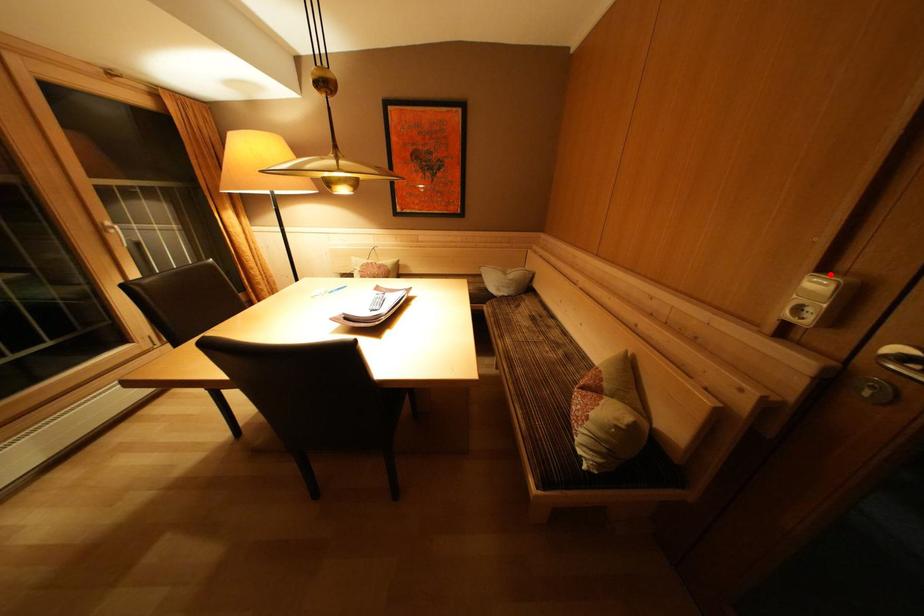
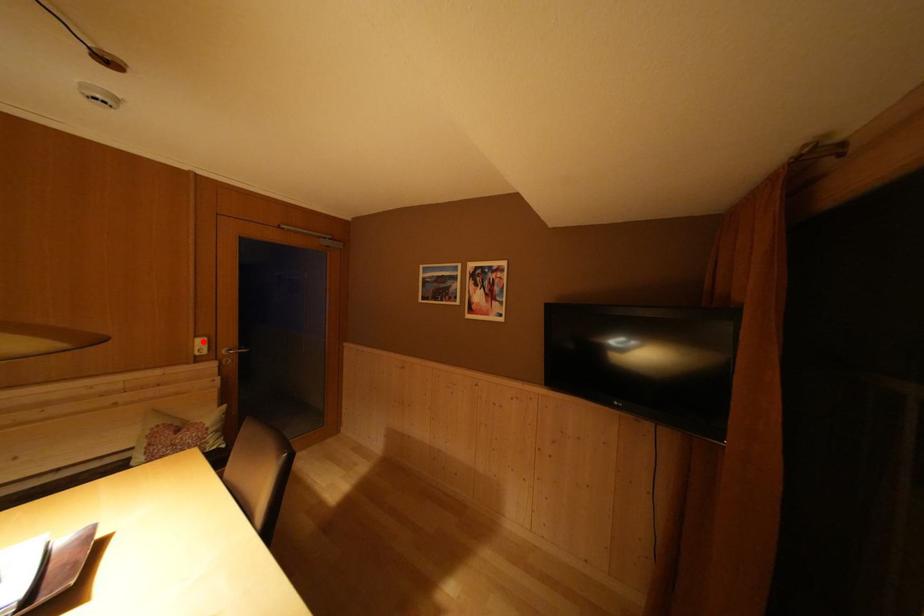
I am providing you with two images of the same scene from different viewpoints. A red point is marked on the first image and another point is marked on the second image. Do the highlighted points in image1 and image2 indicate the same real-world spot?

Yes